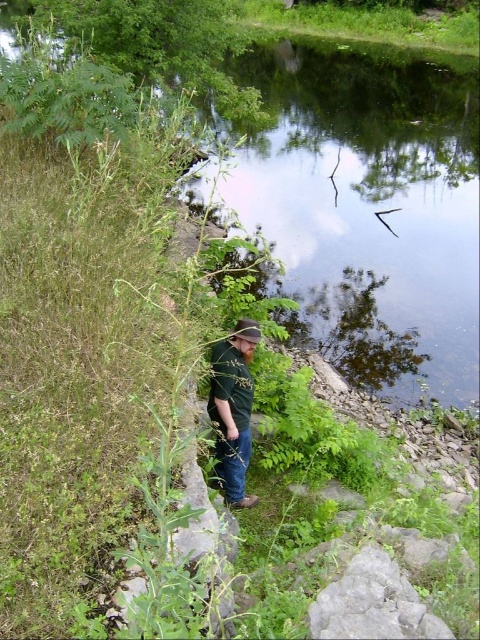
Question: Can you confirm if green matte shirt at center is wider than brown fabric baseball hat at center?

Choices:
 (A) no
 (B) yes

Answer: (B)

Question: Does green matte shirt at center have a lesser width compared to brown fabric baseball hat at center?

Choices:
 (A) yes
 (B) no

Answer: (B)

Question: Does green matte shirt at center have a greater width compared to brown fabric baseball hat at center?

Choices:
 (A) yes
 (B) no

Answer: (A)

Question: Which point is closer to the camera?

Choices:
 (A) brown fabric baseball hat at center
 (B) green matte shirt at center

Answer: (A)